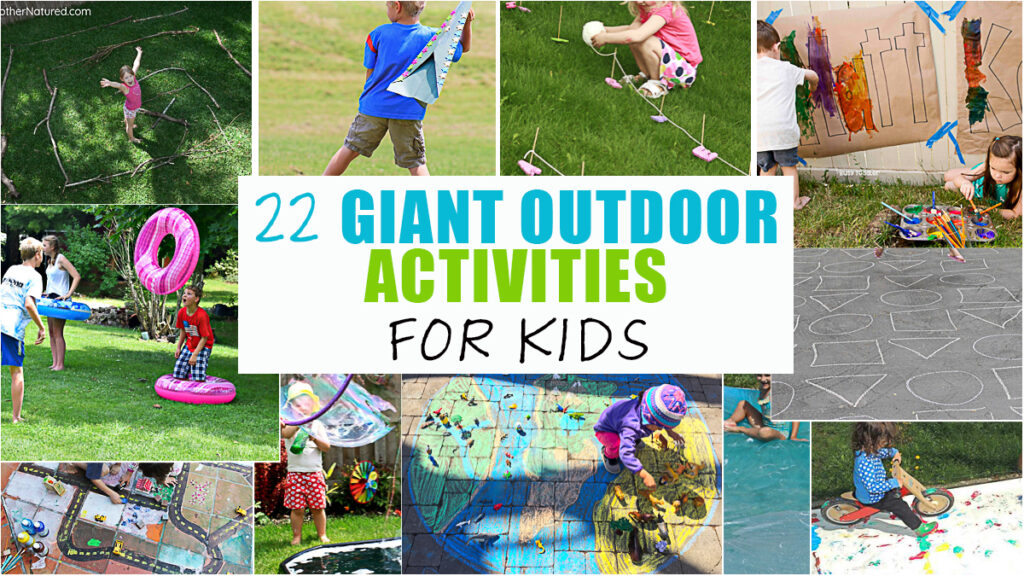
Where is `paint`? This screenshot has width=1024, height=576. paint is located at coordinates (923, 223).